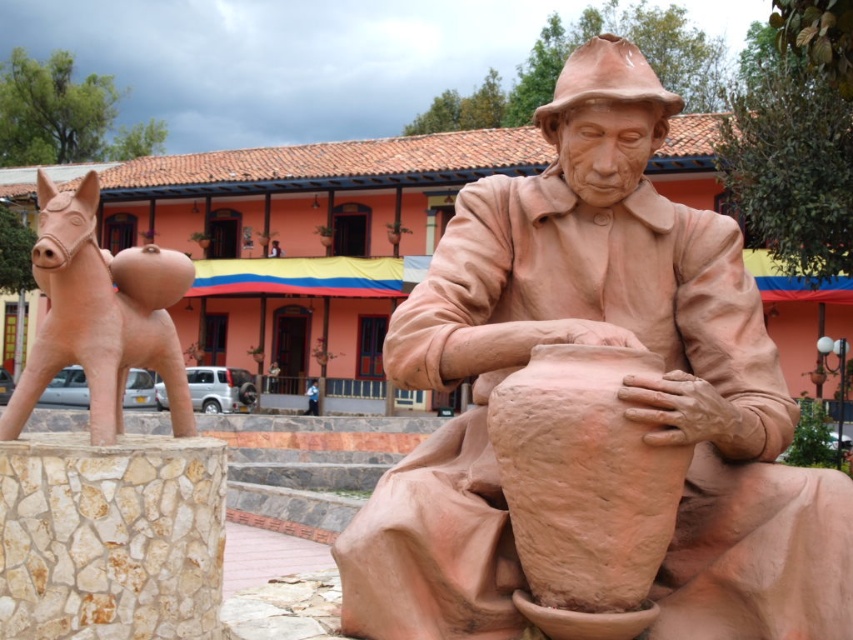
Question: Can you confirm if matte clay potter at center is positioned above matte clay horse at left?

Choices:
 (A) yes
 (B) no

Answer: (B)

Question: Is matte clay potter at center positioned behind matte clay horse at left?

Choices:
 (A) no
 (B) yes

Answer: (A)

Question: Among these objects, which one is nearest to the camera?

Choices:
 (A) matte clay horse at left
 (B) matte clay potter at center

Answer: (B)

Question: Is matte clay potter at center to the left of matte clay horse at left from the viewer's perspective?

Choices:
 (A) yes
 (B) no

Answer: (B)

Question: Which of the following is the farthest from the observer?

Choices:
 (A) (543, 316)
 (B) (126, 333)

Answer: (B)